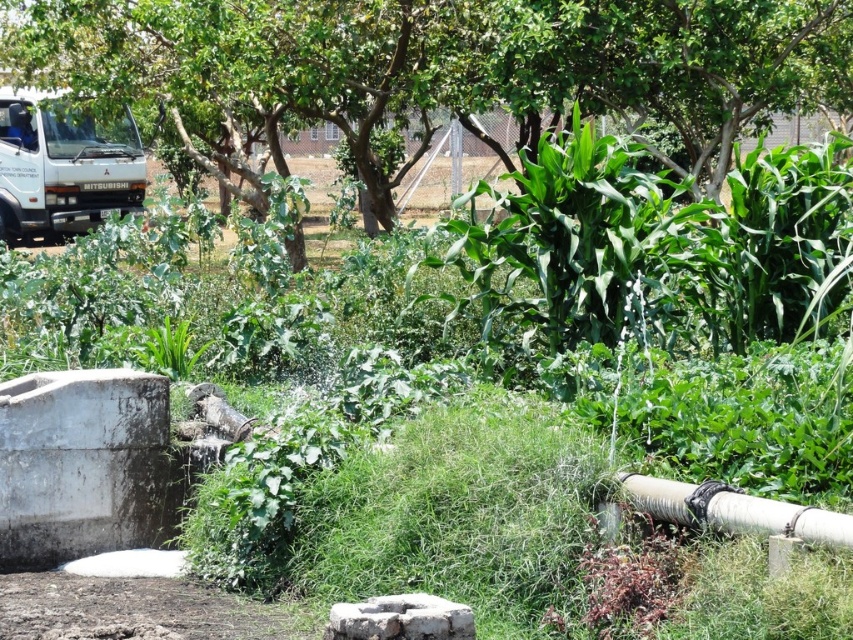
Question: Does green leafy tree at upper center have a lesser width compared to white matte truck at upper left?

Choices:
 (A) yes
 (B) no

Answer: (B)

Question: Among these objects, which one is farthest from the camera?

Choices:
 (A) white matte truck at upper left
 (B) white rubber pipe at lower right

Answer: (A)

Question: Considering the relative positions of green leafy tree at upper center and white matte truck at upper left in the image provided, where is green leafy tree at upper center located with respect to white matte truck at upper left?

Choices:
 (A) left
 (B) right

Answer: (B)

Question: Is the position of green leafy tree at upper center more distant than that of white matte truck at upper left?

Choices:
 (A) yes
 (B) no

Answer: (B)

Question: Which object is the farthest from the green leafy tree at upper center?

Choices:
 (A) white matte truck at upper left
 (B) white rubber pipe at lower right

Answer: (B)

Question: Among these points, which one is farthest from the camera?

Choices:
 (A) (483, 64)
 (B) (59, 182)
 (C) (845, 544)

Answer: (B)